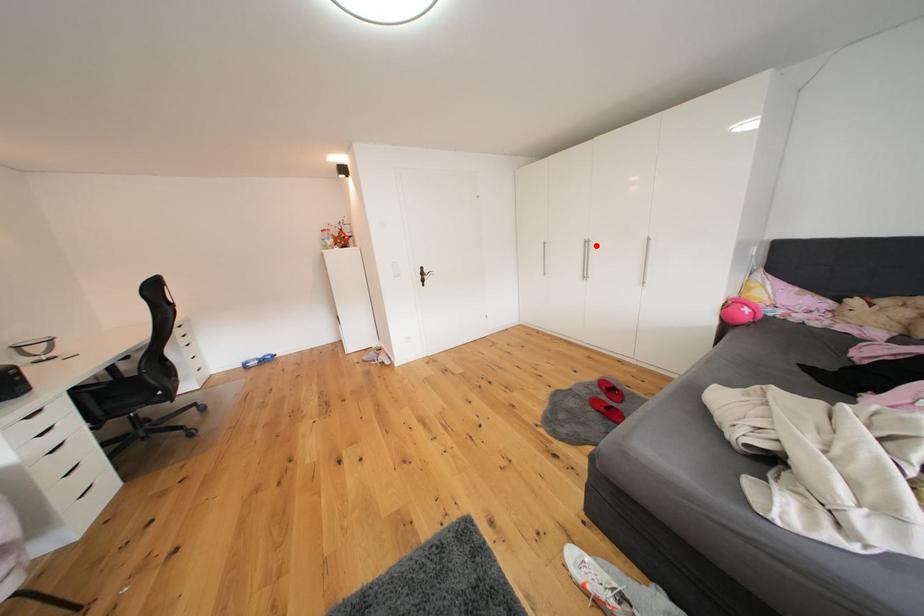
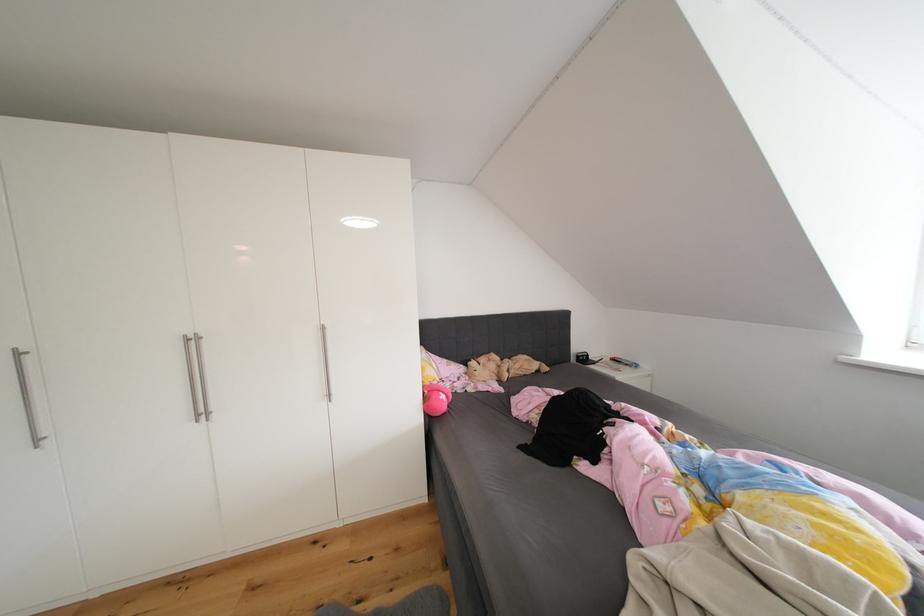
The point at the highlighted location is marked in the first image. Where is the corresponding point in the second image?

(201, 344)